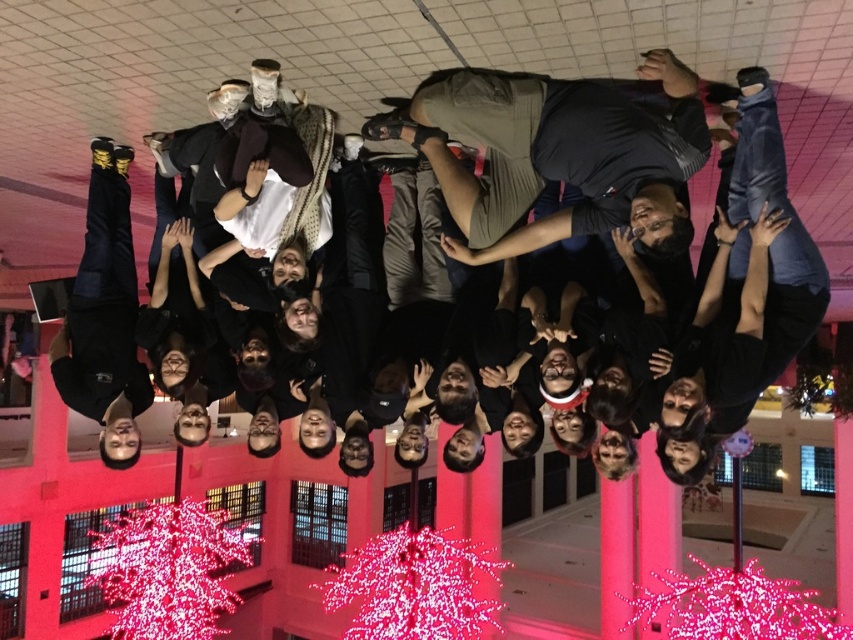
Question: Which point is closer to the camera taking this photo?

Choices:
 (A) (514, 131)
 (B) (560, 173)

Answer: (A)

Question: Can you confirm if black matte shirt at center is positioned below khaki cotton shorts at center?

Choices:
 (A) no
 (B) yes

Answer: (B)

Question: Can you confirm if black matte shirt at center is positioned below khaki cotton shorts at center?

Choices:
 (A) no
 (B) yes

Answer: (B)

Question: Does black matte shirt at center have a larger size compared to khaki cotton shorts at center?

Choices:
 (A) no
 (B) yes

Answer: (B)